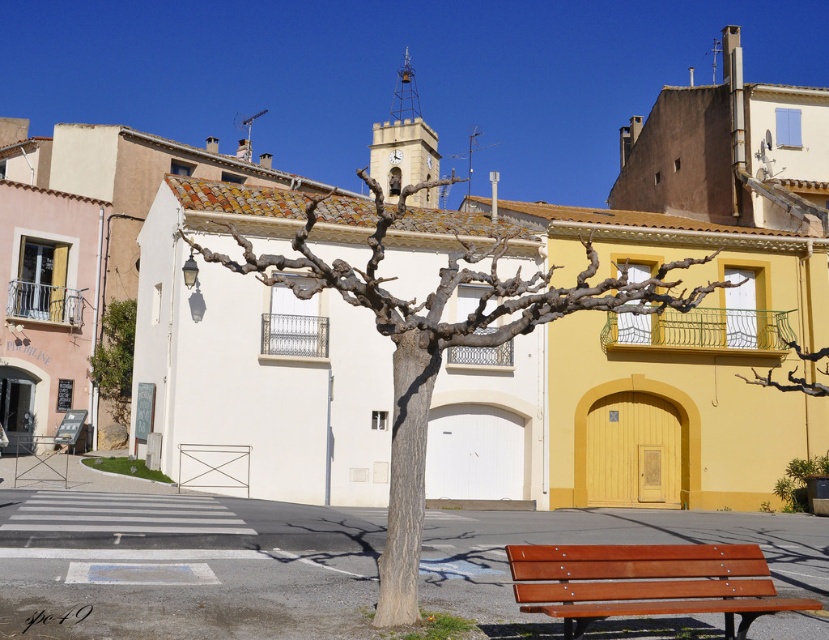
You are a tourist standing at the center of the street. You want to sit down and rest. The brown wooden bench at lower right and the green leafy tree at left are both in your view. Which object is closer to you?

The brown wooden bench at lower right is closer to you because it is located below the green leafy tree at left, indicating it is positioned lower in the scene and thus nearer to your vantage point.

You are an architect designing a new pathway between the bare wood tree at center and the green leafy tree at left. According to the scene, which tree should you place the pathway closer to in order to follow the natural slope of the terrain?

The pathway should be placed closer to the green leafy tree at left because the bare wood tree at center is located above it, indicating a higher elevation.

You are a tourist in this urban area and want to sit on the brown wooden bench at lower right. Can you sit there without walking past the bare wood tree at center?

The brown wooden bench at lower right is behind the bare wood tree at center, so you would need to walk past the bare wood tree at center to reach it.